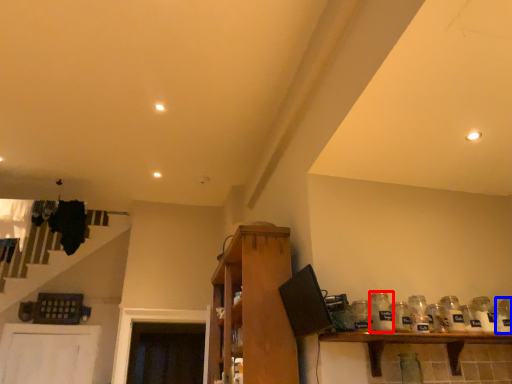
Question: Which of the following is the farthest to the observer, glass bottle (highlighted by a red box) or glass jar (highlighted by a blue box)?

Choices:
 (A) glass bottle
 (B) glass jar

Answer: (B)